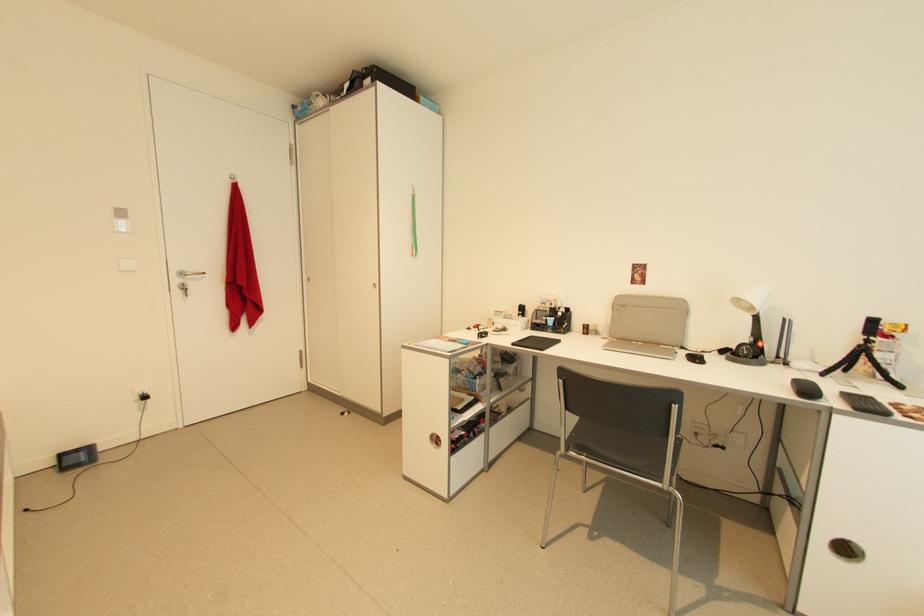
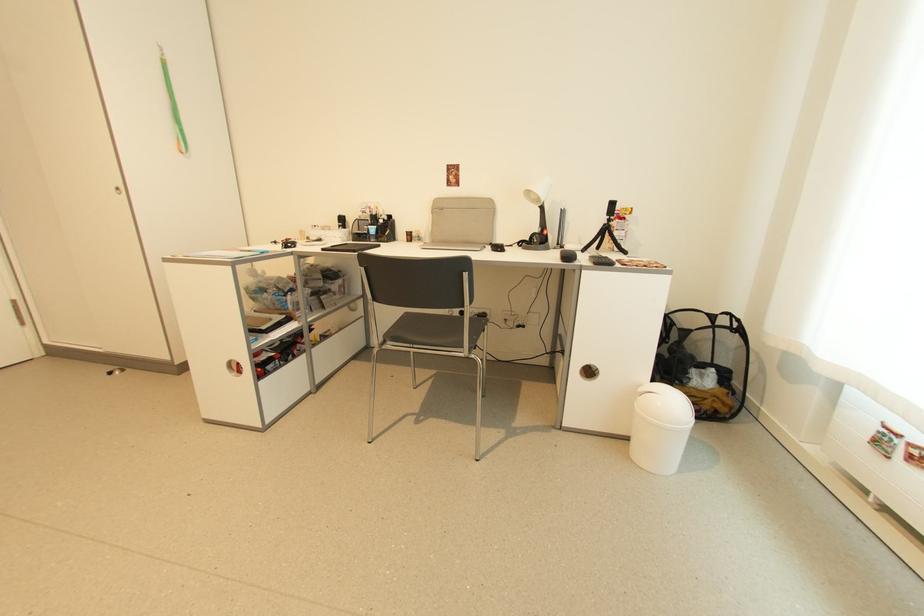
Locate, in the second image, the point that corresponds to (869,337) in the first image.

(612, 217)